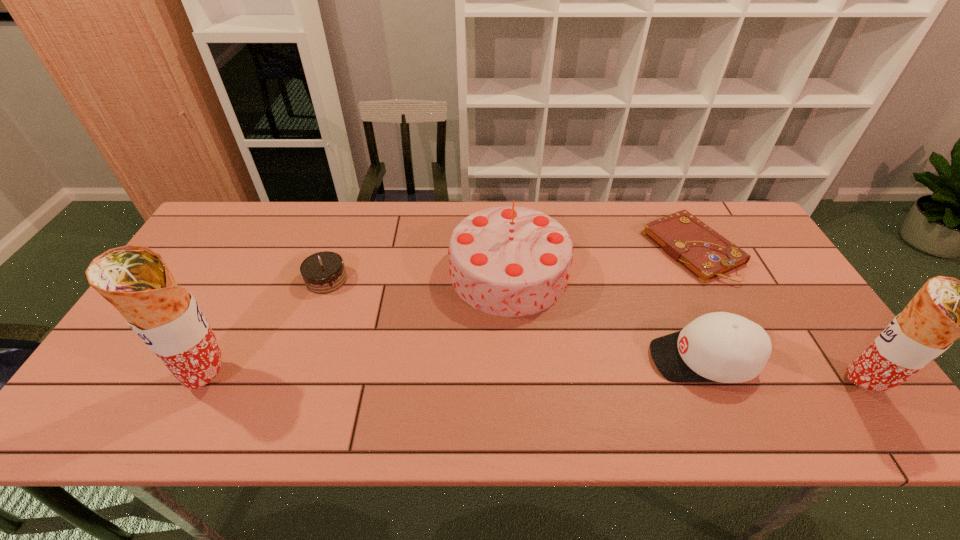
To achieve uniform spacing by inserting another burrito among them, please point to a free space for this new burrito. Please provide its 2D coordinates. Your answer should be formatted as a tuple, i.e. [(x, y)], where the tuple contains the x and y coordinates of a point satisfying the conditions above.

[(534, 381)]